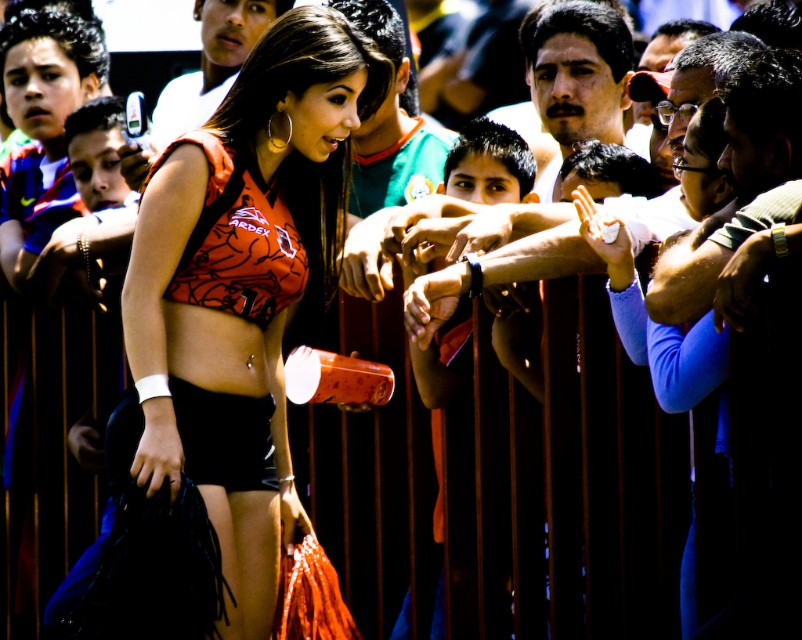
Is matte orange jersey at center to the left of orange matte bikini top at center from the viewer's perspective?

Correct, you'll find matte orange jersey at center to the left of orange matte bikini top at center.

Is point (282, 470) positioned in front of point (239, 170)?

No.

Identify the location of matte orange jersey at center. (240, 291).